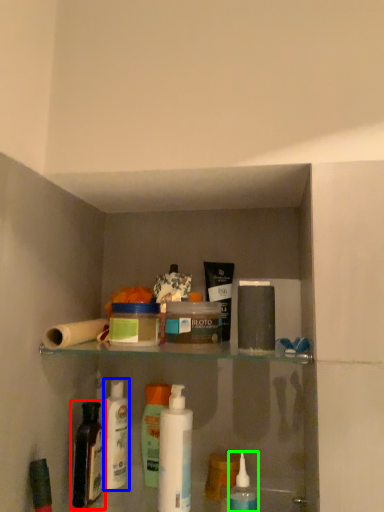
Question: Based on their relative distances, which object is farther from bottle (highlighted by a red box)? Choose from cleaning product (highlighted by a blue box) and mouthwash (highlighted by a green box).

Choices:
 (A) cleaning product
 (B) mouthwash

Answer: (B)